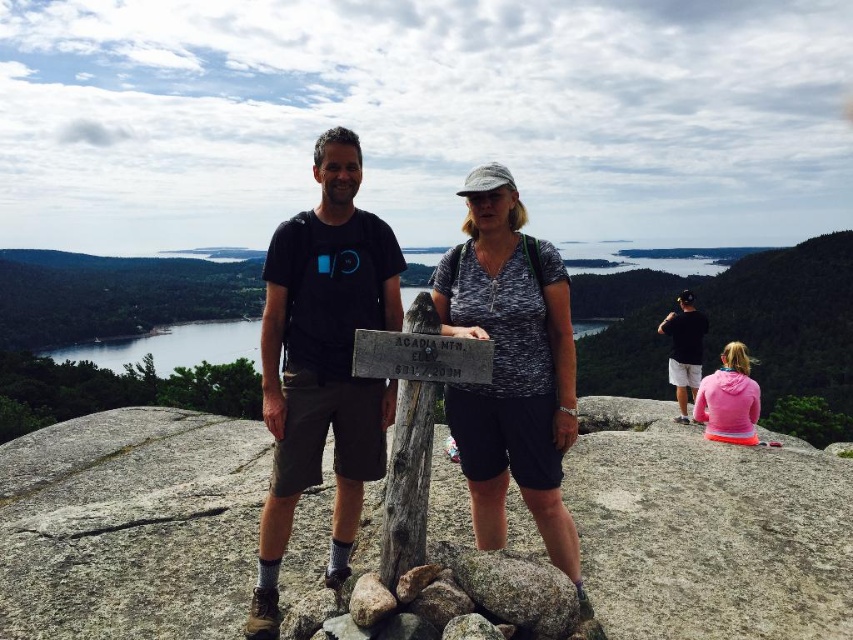
Question: Is black t-shirt at center to the left of matte gray shirt at center from the viewer's perspective?

Choices:
 (A) yes
 (B) no

Answer: (A)

Question: Is pink fleece jacket at lower right thinner than black cotton t-shirt at right?

Choices:
 (A) no
 (B) yes

Answer: (B)

Question: Which object is positioned closest to the pink fleece jacket at lower right?

Choices:
 (A) black cotton t-shirt at right
 (B) black t-shirt at center
 (C) matte black t-shirt at center

Answer: (C)

Question: Which of these objects is positioned closest to the black cotton t-shirt at right?

Choices:
 (A) pink fleece jacket at lower right
 (B) matte gray shirt at center
 (C) black t-shirt at center

Answer: (A)

Question: Does black t-shirt at center have a lesser width compared to pink fleece jacket at lower right?

Choices:
 (A) yes
 (B) no

Answer: (A)

Question: Which object appears farthest from the camera in this image?

Choices:
 (A) clear blue water at center
 (B) black t-shirt at center
 (C) black cotton t-shirt at right
 (D) gray wood sign at center

Answer: (C)